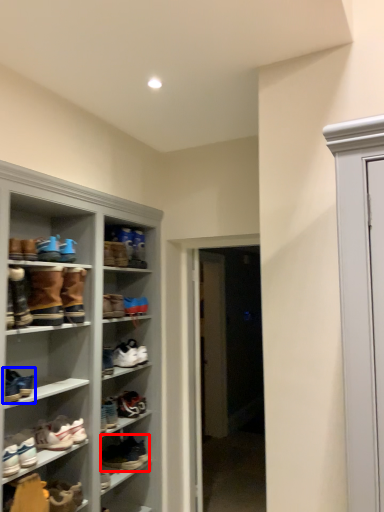
Question: Which object is closer to the camera taking this photo, footwear (highlighted by a red box) or footwear (highlighted by a blue box)?

Choices:
 (A) footwear
 (B) footwear

Answer: (B)